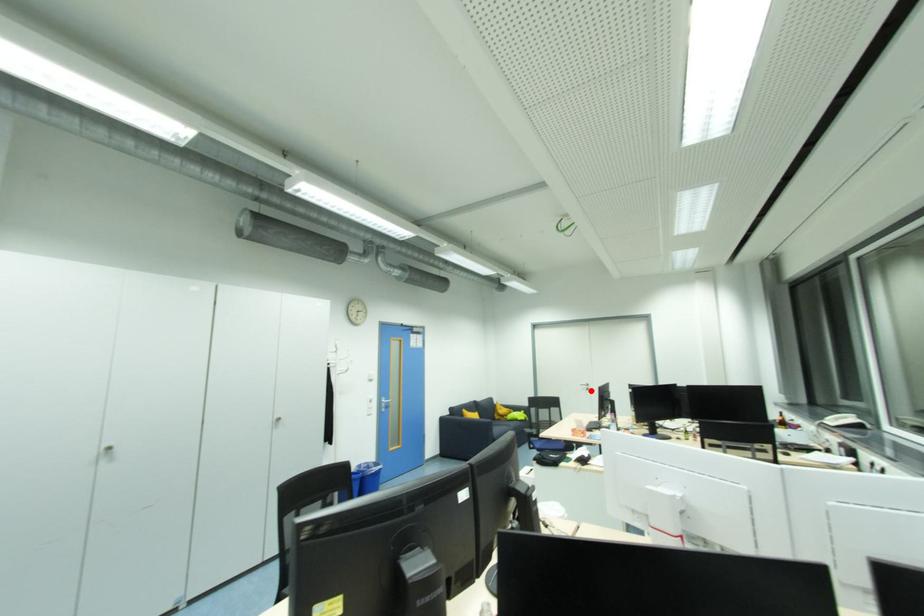
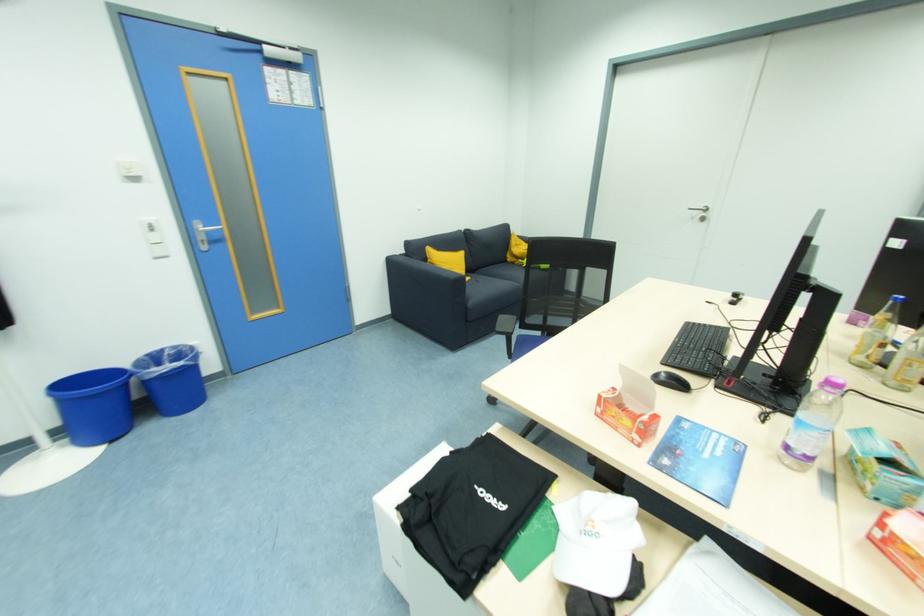
The point at the highlighted location is marked in the first image. Where is the corresponding point in the second image?

(706, 221)